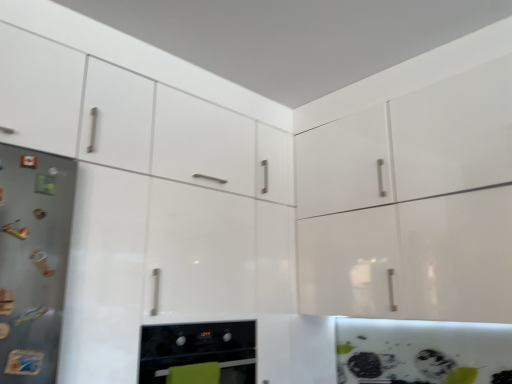
Find the location of a particular element. vacant region above matte black oven at lower center (from a real-world perspective) is located at coordinates (202, 319).